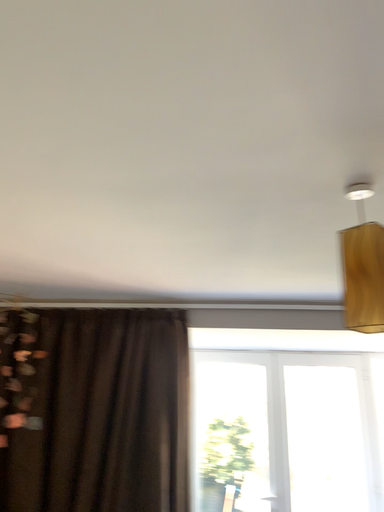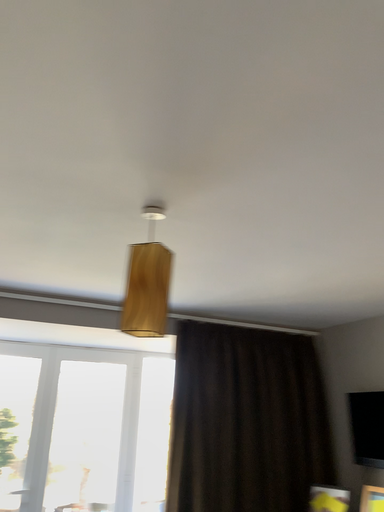
Question: Which way did the camera rotate in the video?

Choices:
 (A) rotated left
 (B) rotated right

Answer: (B)